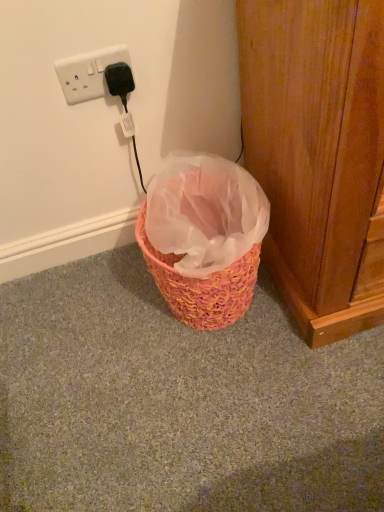
Question: Is wooden at right taller or shorter than white plastic socket at upper left?

Choices:
 (A) short
 (B) tall

Answer: (B)

Question: From a real-world perspective, is wooden at right positioned above or below white plastic socket at upper left?

Choices:
 (A) above
 (B) below

Answer: (B)

Question: Choose the correct answer: Is wooden at right inside white plastic socket at upper left or outside it?

Choices:
 (A) outside
 (B) inside

Answer: (A)

Question: Is white plastic socket at upper left inside the boundaries of wooden at right, or outside?

Choices:
 (A) outside
 (B) inside

Answer: (A)

Question: Based on their positions, is white plastic socket at upper left located to the left or right of wooden at right?

Choices:
 (A) left
 (B) right

Answer: (A)

Question: Looking at the image, does white plastic socket at upper left seem bigger or smaller compared to wooden at right?

Choices:
 (A) small
 (B) big

Answer: (A)

Question: From the image's perspective, is white plastic socket at upper left above or below wooden at right?

Choices:
 (A) above
 (B) below

Answer: (A)